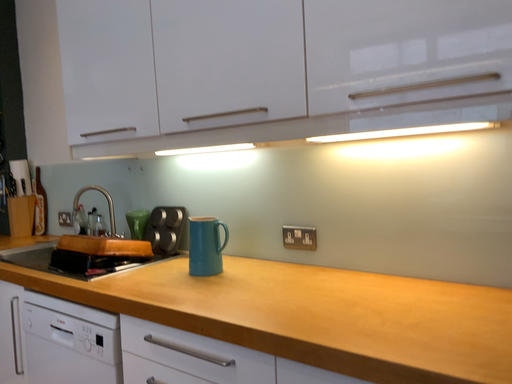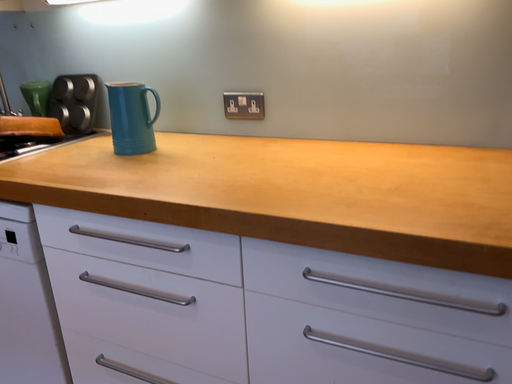
Question: Which way did the camera rotate in the video?

Choices:
 (A) rotated right
 (B) rotated left

Answer: (A)